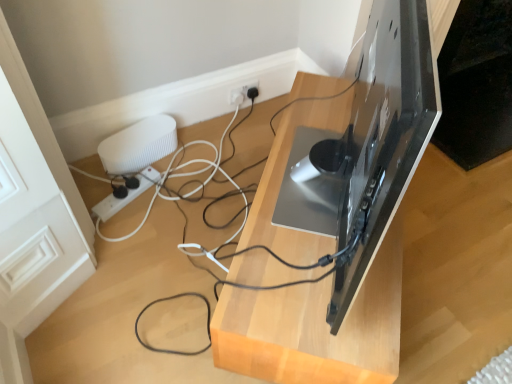
Where is `vacant space situated on the left part of matte black tv stand at center`? This screenshot has height=384, width=512. vacant space situated on the left part of matte black tv stand at center is located at coordinates (161, 255).